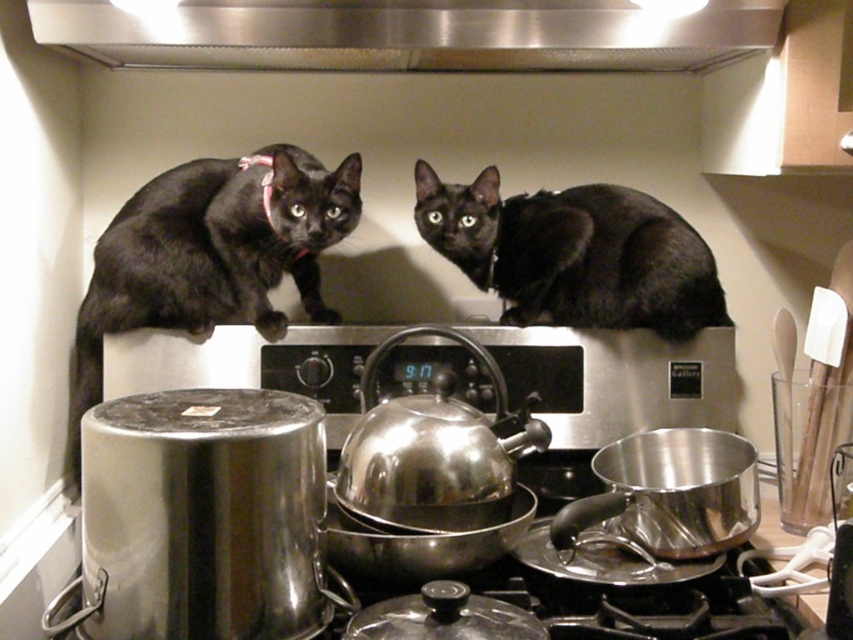
Question: Which object appears farthest from the camera in this image?

Choices:
 (A) matte black cat at upper left
 (B) black matte cat at upper center

Answer: (B)

Question: Among these objects, which one is farthest from the camera?

Choices:
 (A) matte black cat at upper left
 (B) black matte cat at upper center
 (C) stainless steel exhaust hood at upper center

Answer: (B)

Question: Can you confirm if stainless steel exhaust hood at upper center is thinner than black matte cat at upper center?

Choices:
 (A) yes
 (B) no

Answer: (B)

Question: Does stainless steel exhaust hood at upper center have a larger size compared to black matte cat at upper center?

Choices:
 (A) yes
 (B) no

Answer: (A)

Question: Which object appears closest to the camera in this image?

Choices:
 (A) stainless steel exhaust hood at upper center
 (B) black matte cat at upper center

Answer: (A)

Question: Does matte black cat at upper left come in front of black matte cat at upper center?

Choices:
 (A) yes
 (B) no

Answer: (A)